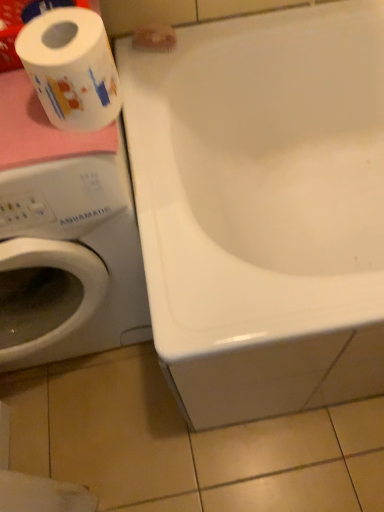
The height and width of the screenshot is (512, 384). What do you see at coordinates (71, 68) in the screenshot?
I see `white printed toilet paper at left, which is counted as the 1th toilet paper, starting from the front` at bounding box center [71, 68].

Where is `white matte toilet paper at upper center, the 1th toilet paper from the top`? This screenshot has height=512, width=384. white matte toilet paper at upper center, the 1th toilet paper from the top is located at coordinates (155, 38).

Describe the element at coordinates (263, 208) in the screenshot. This screenshot has height=512, width=384. I see `white glossy bathtub at upper center` at that location.

Image resolution: width=384 pixels, height=512 pixels. What are the coordinates of `white printed toilet paper at left, which is counted as the 2th toilet paper, starting from the back` in the screenshot? It's located at (71, 68).

Is white glossy bathtub at upper center in front of or behind white matte toilet paper at upper center, the 2th toilet paper in the bottom-to-top sequence, in the image?

Visually, white glossy bathtub at upper center is located in front of white matte toilet paper at upper center, the 2th toilet paper in the bottom-to-top sequence.

From the image's perspective, which one is positioned lower, white glossy bathtub at upper center or white matte toilet paper at upper center, arranged as the second toilet paper when viewed from the front?

white glossy bathtub at upper center is shown below in the image.

Which of these two, white glossy bathtub at upper center or white matte toilet paper at upper center, the 1th toilet paper from the top, stands shorter?

white matte toilet paper at upper center, the 1th toilet paper from the top.

Is white glossy bathtub at upper center next to white matte toilet paper at upper center, the 2th toilet paper in the bottom-to-top sequence?

No, white glossy bathtub at upper center is not next to white matte toilet paper at upper center, the 2th toilet paper in the bottom-to-top sequence.

Consider the image. Is white printed toilet paper at left, marked as the 1th toilet paper in a bottom-to-top arrangement, facing away from white glossy bathtub at upper center?

No, white printed toilet paper at left, marked as the 1th toilet paper in a bottom-to-top arrangement, is not facing away from white glossy bathtub at upper center.

Based on the photo, is white printed toilet paper at left, which is counted as the second toilet paper, starting from the top, far away from white glossy bathtub at upper center?

No.

From a real-world perspective, is white printed toilet paper at left, which is counted as the 1th toilet paper, starting from the front, positioned above or below white glossy bathtub at upper center?

white printed toilet paper at left, which is counted as the 1th toilet paper, starting from the front, is above white glossy bathtub at upper center.

You are a GUI agent. You are given a task and a screenshot of the screen. Output one action in this format:
    pyautogui.click(x=<x>, y=<y>)
    Task: Click on the bathtub behind the white printed toilet paper at left, which is counted as the 1th toilet paper, starting from the front
    
    Given the screenshot: What is the action you would take?
    pyautogui.click(x=263, y=208)

Which object is positioned more to the right, white matte toilet paper at upper center, arranged as the second toilet paper when viewed from the front, or white printed toilet paper at left, which is counted as the 2th toilet paper, starting from the back?

From the viewer's perspective, white matte toilet paper at upper center, arranged as the second toilet paper when viewed from the front, appears more on the right side.

Are white matte toilet paper at upper center, arranged as the second toilet paper when viewed from the front, and white printed toilet paper at left, which is counted as the 1th toilet paper, starting from the front, beside each other?

They are not placed beside each other.

Does white matte toilet paper at upper center, the 2th toilet paper in the bottom-to-top sequence, have a larger size compared to white printed toilet paper at left, which is counted as the 1th toilet paper, starting from the front?

Incorrect, white matte toilet paper at upper center, the 2th toilet paper in the bottom-to-top sequence, is not larger than white printed toilet paper at left, which is counted as the 1th toilet paper, starting from the front.

Who is bigger, white glossy bathtub at upper center or white printed toilet paper at left, which is counted as the 1th toilet paper, starting from the front?

Bigger between the two is white glossy bathtub at upper center.

Looking at this image, is white glossy bathtub at upper center aimed at white printed toilet paper at left, marked as the 1th toilet paper in a bottom-to-top arrangement?

No, white glossy bathtub at upper center is not aimed at white printed toilet paper at left, marked as the 1th toilet paper in a bottom-to-top arrangement.

Does point (332, 352) lie behind point (111, 99)?

Yes, it is behind point (111, 99).

Measure the distance between white glossy bathtub at upper center and white printed toilet paper at left, marked as the 1th toilet paper in a bottom-to-top arrangement.

white glossy bathtub at upper center and white printed toilet paper at left, marked as the 1th toilet paper in a bottom-to-top arrangement, are 16.77 inches apart from each other.

Is white printed toilet paper at left, which is counted as the 2th toilet paper, starting from the back, inside the boundaries of white matte toilet paper at upper center, arranged as the second toilet paper when viewed from the front, or outside?

white printed toilet paper at left, which is counted as the 2th toilet paper, starting from the back, is not inside white matte toilet paper at upper center, arranged as the second toilet paper when viewed from the front, it's outside.

From a real-world perspective, is white printed toilet paper at left, marked as the 1th toilet paper in a bottom-to-top arrangement, positioned above or below white matte toilet paper at upper center, the 2th toilet paper in the bottom-to-top sequence?

white printed toilet paper at left, marked as the 1th toilet paper in a bottom-to-top arrangement, is above white matte toilet paper at upper center, the 2th toilet paper in the bottom-to-top sequence.

Visually, is white printed toilet paper at left, which is counted as the second toilet paper, starting from the top, positioned to the left or to the right of white matte toilet paper at upper center, placed as the 1th toilet paper when sorted from back to front?

Clearly, white printed toilet paper at left, which is counted as the second toilet paper, starting from the top, is on the left of white matte toilet paper at upper center, placed as the 1th toilet paper when sorted from back to front, in the image.

Locate an element on the screen. This screenshot has height=512, width=384. toilet paper to the right of white printed toilet paper at left, which is counted as the 2th toilet paper, starting from the back is located at coordinates (155, 38).

What's the angular difference between white matte toilet paper at upper center, the 2th toilet paper in the bottom-to-top sequence, and white glossy bathtub at upper center's facing directions?

The angular difference between white matte toilet paper at upper center, the 2th toilet paper in the bottom-to-top sequence, and white glossy bathtub at upper center is 0.0045 degrees.

Measure the distance from white matte toilet paper at upper center, placed as the 1th toilet paper when sorted from back to front, to white glossy bathtub at upper center.

white matte toilet paper at upper center, placed as the 1th toilet paper when sorted from back to front, is 15.78 inches away from white glossy bathtub at upper center.

Consider the image. Which is more to the right, white matte toilet paper at upper center, arranged as the second toilet paper when viewed from the front, or white glossy bathtub at upper center?

white glossy bathtub at upper center.

The height and width of the screenshot is (512, 384). In the image, there is a white matte toilet paper at upper center, arranged as the second toilet paper when viewed from the front. Find the location of `bathtub below it (from the image's perspective)`. bathtub below it (from the image's perspective) is located at coordinates (263, 208).

I want to click on toilet paper behind the white glossy bathtub at upper center, so click(x=155, y=38).

There is a white glossy bathtub at upper center. Identify the location of the 2nd toilet paper above it (from a real-world perspective). (71, 68).

When comparing their distances from white printed toilet paper at left, which is counted as the second toilet paper, starting from the top, does white glossy bathtub at upper center or white matte toilet paper at upper center, arranged as the second toilet paper when viewed from the front, seem closer?

The object closer to white printed toilet paper at left, which is counted as the second toilet paper, starting from the top, is white matte toilet paper at upper center, arranged as the second toilet paper when viewed from the front.

Consider the image. Looking at the image, which one is located closer to white glossy bathtub at upper center, white printed toilet paper at left, which is counted as the 2th toilet paper, starting from the back, or white matte toilet paper at upper center, arranged as the second toilet paper when viewed from the front?

white matte toilet paper at upper center, arranged as the second toilet paper when viewed from the front.

When comparing their distances from white printed toilet paper at left, which is counted as the 2th toilet paper, starting from the back, does white matte toilet paper at upper center, the 1th toilet paper from the top, or white glossy bathtub at upper center seem further?

Answer: Among the two, white glossy bathtub at upper center is located further to white printed toilet paper at left, which is counted as the 2th toilet paper, starting from the back.

From the image, which object appears to be nearer to white matte toilet paper at upper center, the 1th toilet paper from the top, white glossy bathtub at upper center or white printed toilet paper at left, marked as the 1th toilet paper in a bottom-to-top arrangement?

white glossy bathtub at upper center is closer to white matte toilet paper at upper center, the 1th toilet paper from the top.

Based on the photo, from the image, which object appears to be farther from white glossy bathtub at upper center, white matte toilet paper at upper center, the 1th toilet paper from the top, or white printed toilet paper at left, which is counted as the 1th toilet paper, starting from the front?

Among the two, white printed toilet paper at left, which is counted as the 1th toilet paper, starting from the front, is located further to white glossy bathtub at upper center.

When comparing their distances from white matte toilet paper at upper center, placed as the 1th toilet paper when sorted from back to front, does white printed toilet paper at left, marked as the 1th toilet paper in a bottom-to-top arrangement, or white glossy bathtub at upper center seem further?

Based on the image, white printed toilet paper at left, marked as the 1th toilet paper in a bottom-to-top arrangement, appears to be further to white matte toilet paper at upper center, placed as the 1th toilet paper when sorted from back to front.

Find the location of a particular element. The width and height of the screenshot is (384, 512). toilet paper between white printed toilet paper at left, which is counted as the second toilet paper, starting from the top, and white glossy bathtub at upper center, in the horizontal direction is located at coordinates (155, 38).